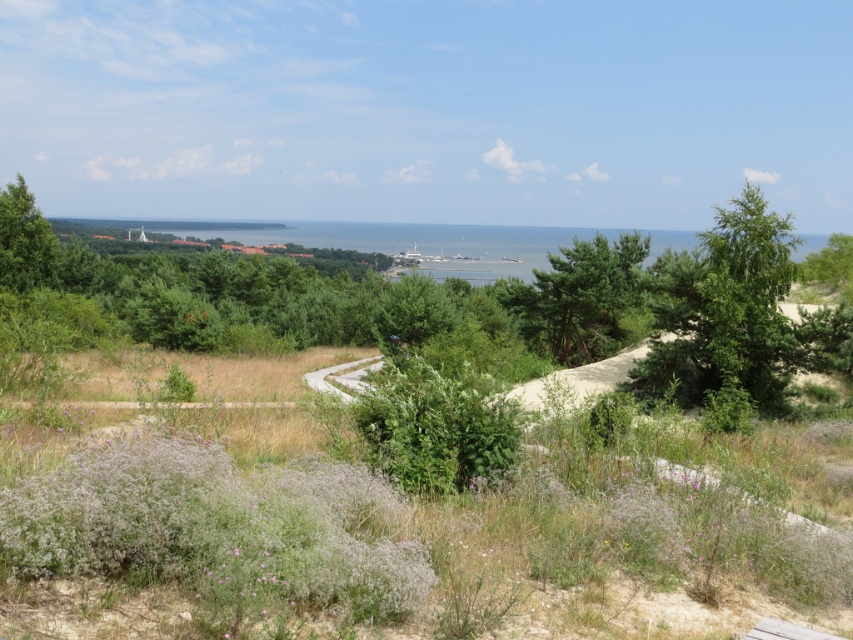
You are a hiker planning to walk along the winding path from the bottom right to the center. There are two trees in the scene, the green textured pine tree at center and the green leafy tree at upper left. Which tree would you pass closer to as you walk along the path?

The green textured pine tree at center is wider than the green leafy tree at upper left, so you would pass closer to the green textured pine tree at center as you walk along the path.

You are planning to plant a new tree in this coastal landscape. The new tree will be the same species as the green leafy tree at upper left. Based on the scene, where should you plant it if you want it to grow to be as wide as the green leafy tree at right?

You should plant the new tree in a location with more space, like the area near the right side of the scene, since the green leafy tree at right is wider than the green leafy tree at upper left. This suggests that trees in that area have more room to grow wider.